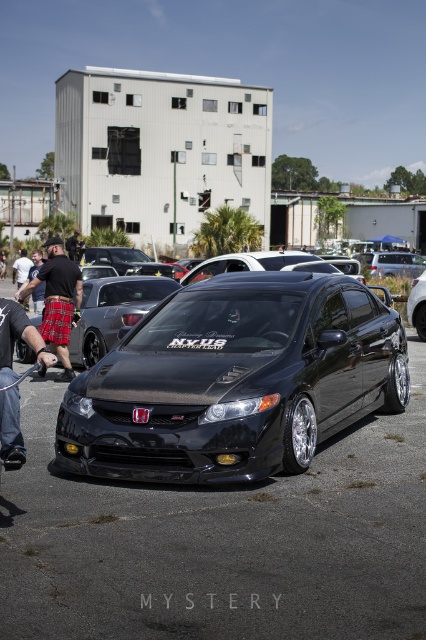
Question: Can you confirm if black polished car at center is positioned to the left of black matte car at center?

Choices:
 (A) yes
 (B) no

Answer: (A)

Question: Which is nearer to the black polished car at center?

Choices:
 (A) black leather pants at lower left
 (B) black matte car at center
 (C) black plaid shorts at left
 (D) black plaid shorts at lower left

Answer: (A)

Question: Where is black polished car at center located in relation to black fabric shorts at lower left in the image?

Choices:
 (A) above
 (B) below

Answer: (B)

Question: Which point is closer to the camera?

Choices:
 (A) black leather pants at lower left
 (B) black polished car at center
 (C) black plaid shorts at left
 (D) black plaid shorts at lower left

Answer: (A)

Question: Where is black glossy car at center located in relation to black polished car at center in the image?

Choices:
 (A) right
 (B) left

Answer: (A)

Question: Which of the following is the farthest from the observer?

Choices:
 (A) (77, 285)
 (B) (2, 394)
 (C) (37, 532)

Answer: (A)